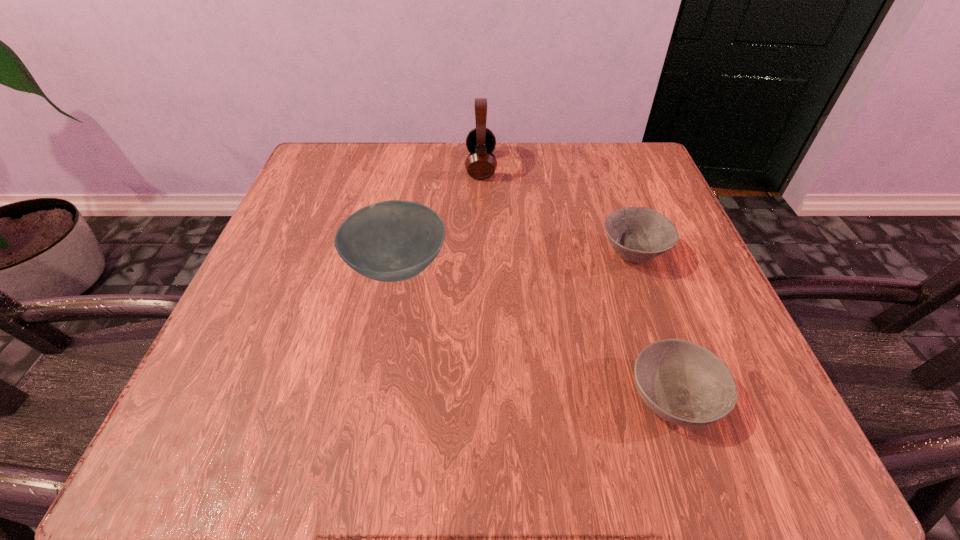
The height and width of the screenshot is (540, 960). In order to click on the third object from right to left in this screenshot , I will do `click(480, 164)`.

Image resolution: width=960 pixels, height=540 pixels. What are the coordinates of `the tallest object` in the screenshot? It's located at (480, 164).

The width and height of the screenshot is (960, 540). I want to click on the leftmost object, so click(x=389, y=241).

Find the location of a particular element. This screenshot has width=960, height=540. the third shortest object is located at coordinates (389, 241).

Locate an element on the screen. the second shortest bowl is located at coordinates (637, 234).

Locate an element on the screen. The height and width of the screenshot is (540, 960). the shortest bowl is located at coordinates (682, 382).

Locate an element on the screen. This screenshot has width=960, height=540. the nearest bowl is located at coordinates (682, 382).

At what (x,y) coordinates should I click in order to perform the action: click on free point located 0.220m on the ear pads of the second object from left to right. Please return your answer as a coordinate pair (x, y). The width and height of the screenshot is (960, 540). Looking at the image, I should click on (368, 166).

Where is `free point located 0.360m on the ear pads of the second object from left to right`? Image resolution: width=960 pixels, height=540 pixels. free point located 0.360m on the ear pads of the second object from left to right is located at coordinates click(x=304, y=166).

Find the location of a particular element. vacant space located 0.070m on the ear pads of the second object from left to right is located at coordinates (434, 166).